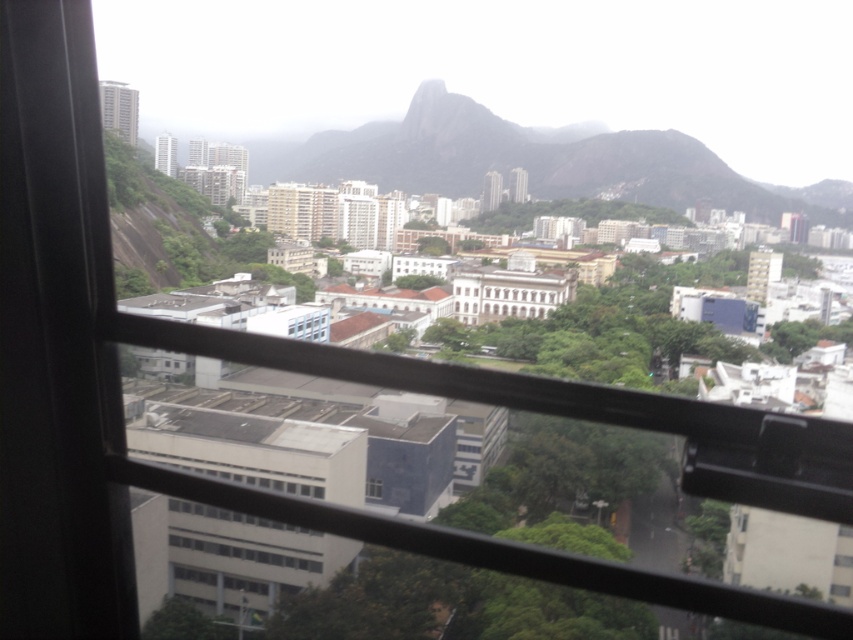
Question: Observing the image, what is the correct spatial positioning of transparent plastic window at center in reference to transparent glass window at center?

Choices:
 (A) above
 (B) below

Answer: (A)

Question: Which point is closer to the camera?

Choices:
 (A) (366, 497)
 (B) (300, 320)

Answer: (A)

Question: Can you confirm if transparent plastic window at center is positioned to the left of transparent glass window at center?

Choices:
 (A) yes
 (B) no

Answer: (A)

Question: Does transparent plastic window at center appear on the left side of transparent glass window at center?

Choices:
 (A) no
 (B) yes

Answer: (B)